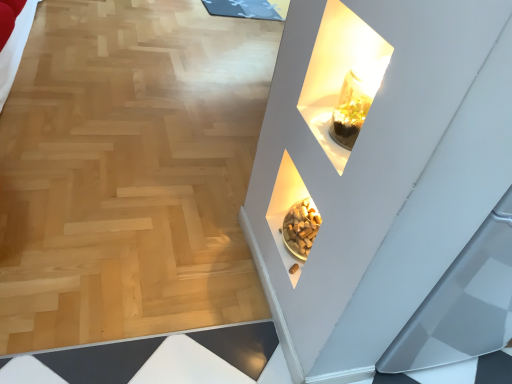
Image resolution: width=512 pixels, height=384 pixels. Describe the element at coordinates (335, 71) in the screenshot. I see `transparent glass vase at upper center` at that location.

I want to click on transparent glass vase at upper center, so click(335, 71).

Find the location of a particular element. transparent glass vase at upper center is located at coordinates [x=335, y=71].